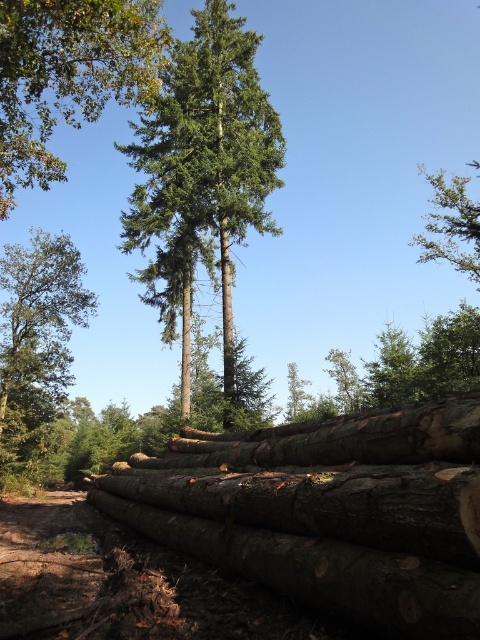
Is green matte tree at left shorter than green matte tree at upper right?

Indeed, green matte tree at left has a lesser height compared to green matte tree at upper right.

Can you confirm if green matte tree at left is positioned to the left of green matte tree at upper right?

Correct, you'll find green matte tree at left to the left of green matte tree at upper right.

Does point (81, 320) lie behind point (478, 250)?

That is True.

This screenshot has height=640, width=480. Find the location of `green matte tree at left`. green matte tree at left is located at coordinates (36, 337).

Between green matte tree at upper left and green matte tree at left, which one has less height?

green matte tree at left

Does green matte tree at upper left appear over green matte tree at left?

Indeed, green matte tree at upper left is positioned over green matte tree at left.

Image resolution: width=480 pixels, height=640 pixels. Find the location of `green matte tree at upper left`. green matte tree at upper left is located at coordinates (68, 74).

Find the location of a particular element. This screenshot has width=480, height=640. green matte tree at upper left is located at coordinates (68, 74).

Can you confirm if green textured tree at center is positioned above green matte tree at upper right?

No.

Describe the element at coordinates (207, 154) in the screenshot. I see `green textured tree at center` at that location.

Where is `green textured tree at center`? The width and height of the screenshot is (480, 640). green textured tree at center is located at coordinates (207, 154).